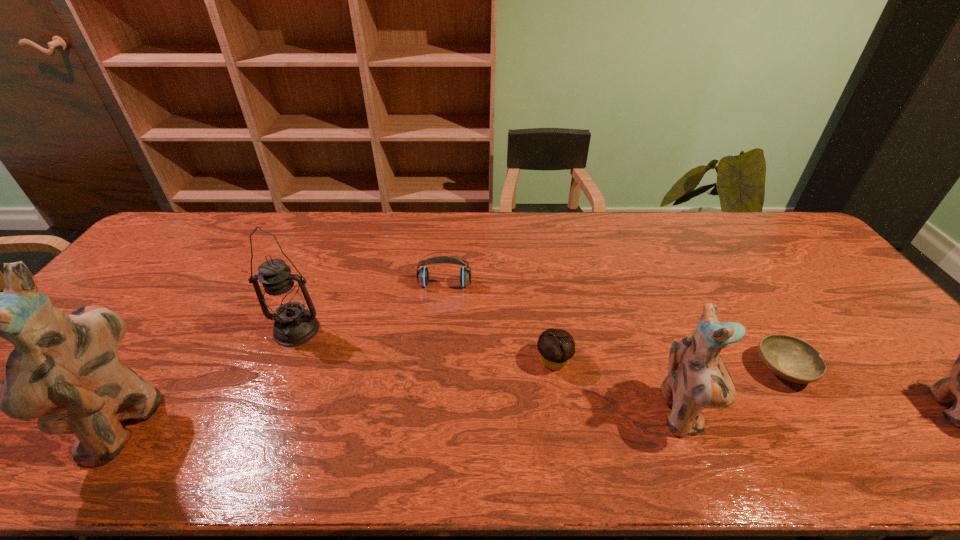
Please mark a free spot for a new figurine to balance the arrangement. Please provide its 2D coordinates. Your answer should be formatted as a tuple, i.e. [(x, y)], where the tuple contains the x and y coordinates of a point satisfying the conditions above.

[(405, 419)]